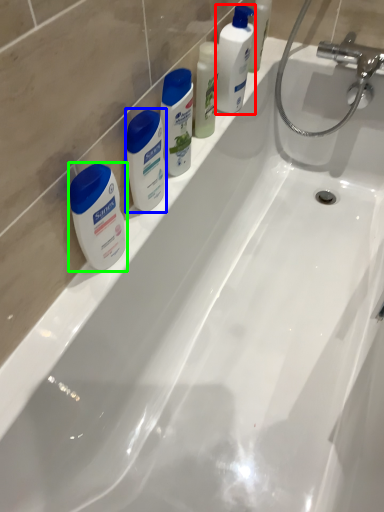
Question: Based on their relative distances, which object is farther from cleaning product (highlighted by a red box)? Choose from toiletry (highlighted by a blue box) and toiletry (highlighted by a green box).

Choices:
 (A) toiletry
 (B) toiletry

Answer: (B)